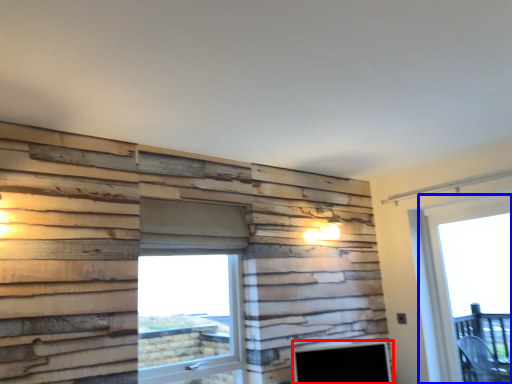
Question: Which point is further to the camera, fireplace (highlighted by a red box) or window (highlighted by a blue box)?

Choices:
 (A) fireplace
 (B) window

Answer: (B)